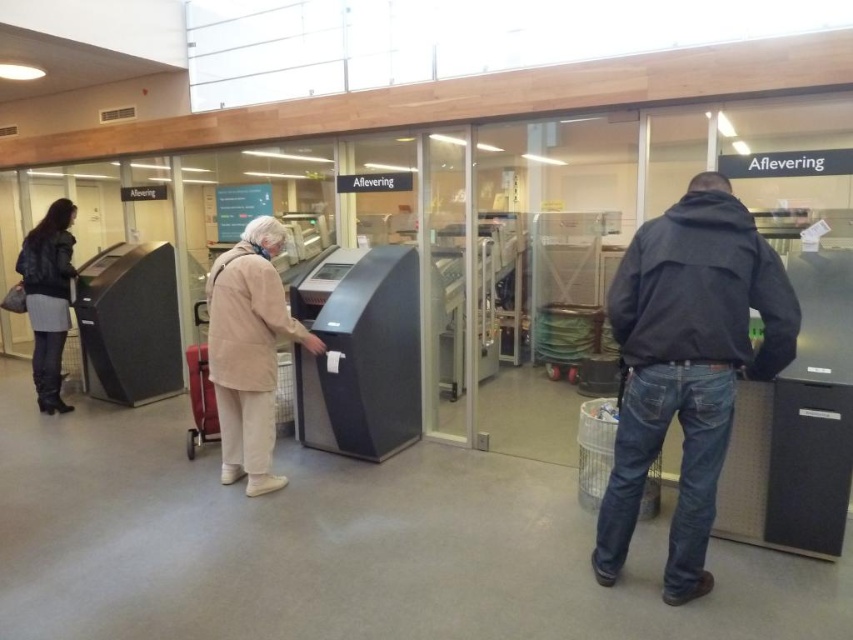
Question: Is dark blue jacket at right thinner than matte black jacket at left?

Choices:
 (A) no
 (B) yes

Answer: (A)

Question: Estimate the real-world distances between objects in this image. Which object is farther from the matte black jacket at left?

Choices:
 (A) beige fabric coat at center
 (B) dark blue jacket at right

Answer: (B)

Question: Can you confirm if dark blue jacket at right is wider than beige fabric coat at center?

Choices:
 (A) yes
 (B) no

Answer: (A)

Question: Is dark blue jacket at right to the right of matte black jacket at left from the viewer's perspective?

Choices:
 (A) yes
 (B) no

Answer: (A)

Question: Which object appears farthest from the camera in this image?

Choices:
 (A) beige fabric coat at center
 (B) matte black jacket at left

Answer: (B)

Question: Which of the following is the closest to the observer?

Choices:
 (A) (219, 365)
 (B) (51, 259)

Answer: (A)